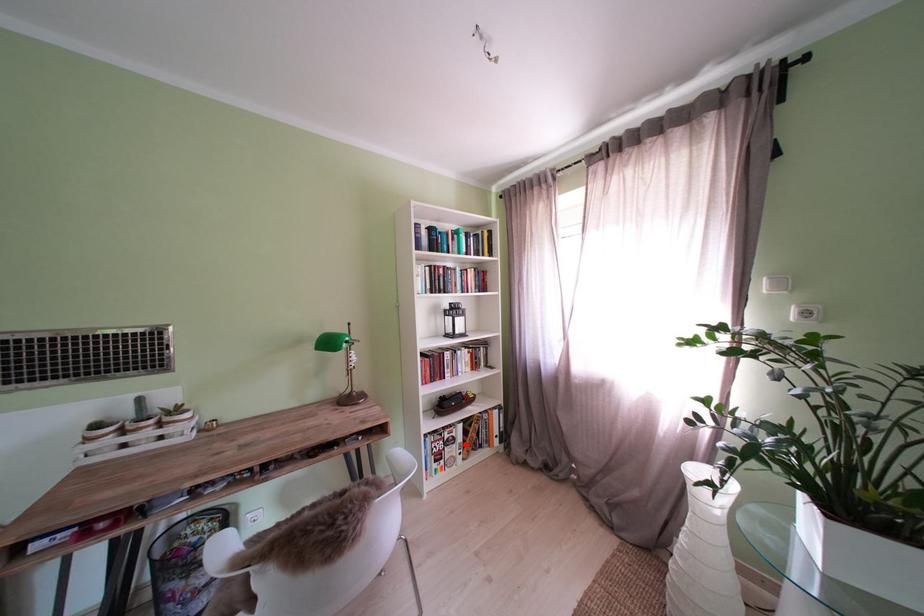
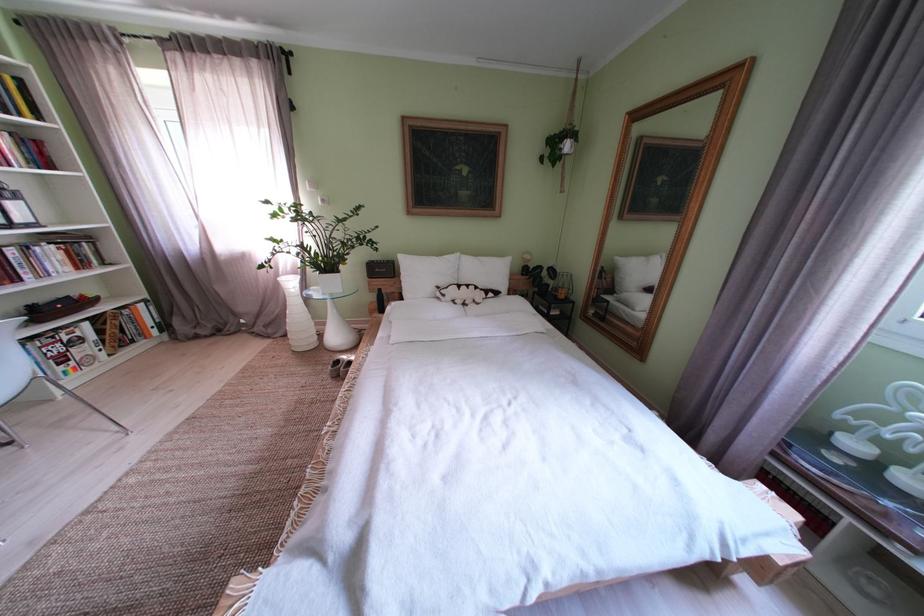
Locate, in the second image, the point that corresponds to the highlighted location in the first image.

(92, 344)